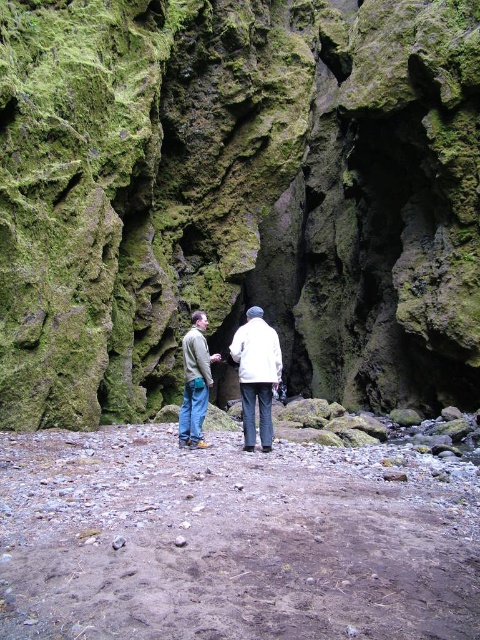
You are a photographer trying to capture a photo of the green mossy rock at center and the white woolen jacket at center. If you want to ensure both subjects are in focus, what is the minimum distance you should set your camera lens to?

The green mossy rock at center is 70.68 feet away from the white woolen jacket at center. To ensure both are in focus, the camera lens should be set to a distance between the two subjects, ideally around the midpoint of 35.34 feet.

Consider the image. You are hiking and come across this scene. You need to place a small marker between the green mossy rock at center and the white woolen jacket at center. Where should you place it to be exactly between them?

The marker should be placed to the left of the green mossy rock at center, since the white woolen jacket at center is to the left of the green mossy rock at center, so the midpoint between them would be to the left of the rock.